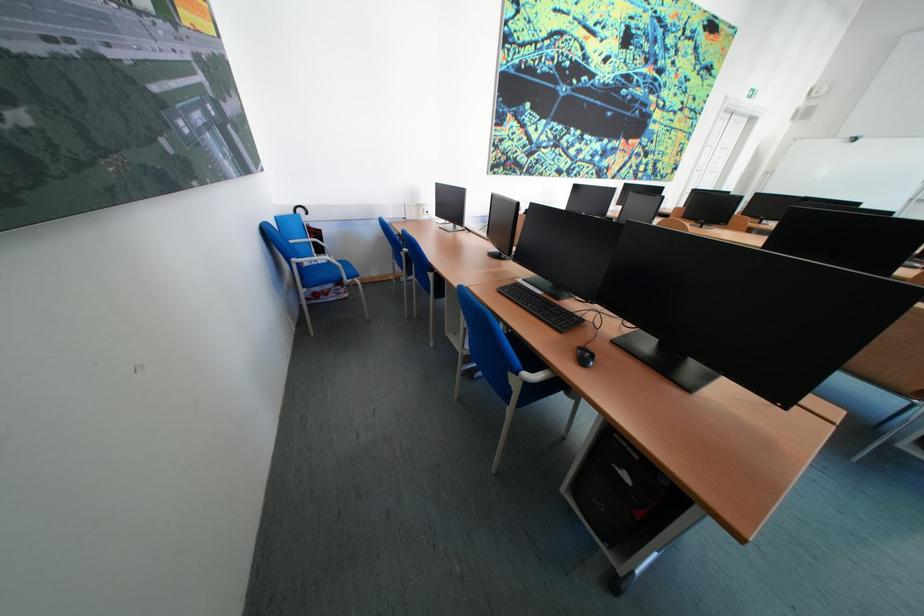
Where would you typ the black keyboard? Please return your answer as a coordinate pair (x, y).

(541, 307)